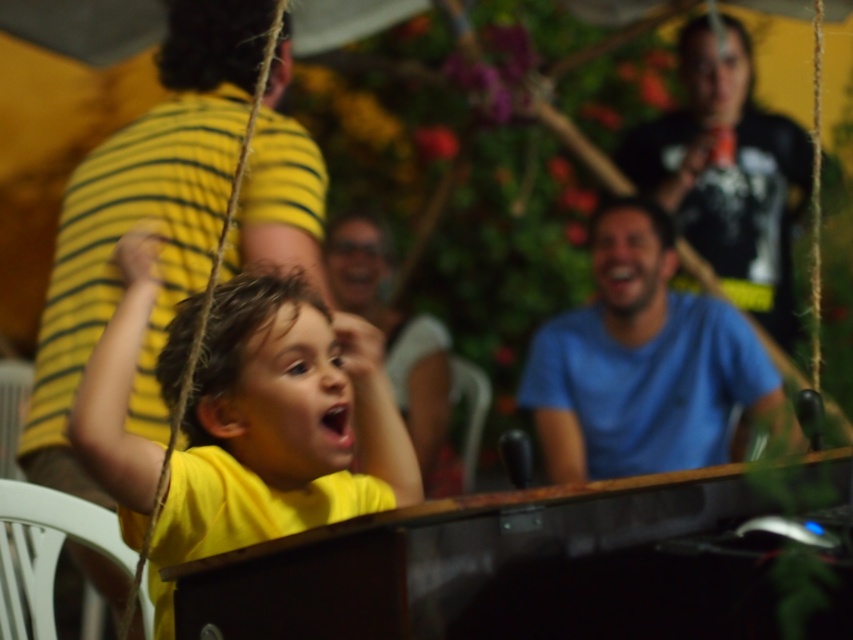
Question: Considering the real-world distances, which object is closest to the matte black shirt at upper right?

Choices:
 (A) matte yellow shirt at center
 (B) yellow striped shirt at left
 (C) yellow matte shirt at center
 (D) blue cotton shirt at center

Answer: (D)

Question: Does yellow striped shirt at left have a lesser width compared to yellow matte shirt at center?

Choices:
 (A) no
 (B) yes

Answer: (A)

Question: Is yellow striped shirt at left positioned in front of matte black shirt at upper right?

Choices:
 (A) no
 (B) yes

Answer: (B)

Question: Is yellow striped shirt at left bigger than yellow matte shirt at center?

Choices:
 (A) yes
 (B) no

Answer: (A)

Question: Which object is the farthest from the yellow striped shirt at left?

Choices:
 (A) yellow matte shirt at center
 (B) matte black shirt at upper right
 (C) matte yellow shirt at center

Answer: (B)

Question: Estimate the real-world distances between objects in this image. Which object is closer to the matte yellow shirt at center?

Choices:
 (A) yellow striped shirt at left
 (B) matte black shirt at upper right
 (C) blue cotton shirt at center
 (D) yellow matte shirt at center

Answer: (C)